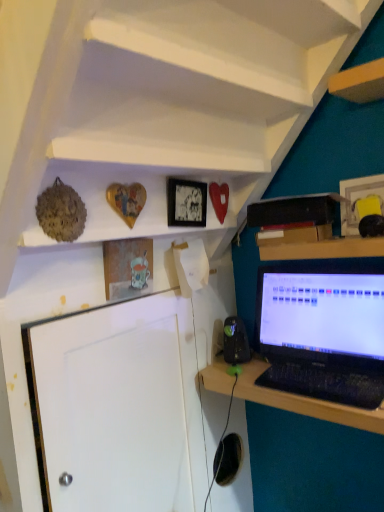
Question: From a real-world perspective, is wooden heart at upper center, arranged as the 2th shelf when viewed from the top, physically below matte black picture frame at upper center, the 2th picture frame viewed from the right?

Choices:
 (A) no
 (B) yes

Answer: (A)

Question: Is wooden heart at upper center, arranged as the 2th shelf when viewed from the top, smaller than matte black picture frame at upper center, which ranks as the 2th picture frame in left-to-right order?

Choices:
 (A) no
 (B) yes

Answer: (A)

Question: Is wooden heart at upper center, which is the first shelf in bottom-to-top order, thinner than matte black picture frame at upper center, the 2th picture frame viewed from the right?

Choices:
 (A) yes
 (B) no

Answer: (B)

Question: Would you say wooden heart at upper center, arranged as the 2th shelf when viewed from the top, is a long distance from matte black picture frame at upper center, which ranks as the 2th picture frame in left-to-right order?

Choices:
 (A) no
 (B) yes

Answer: (A)

Question: Could you tell me if wooden heart at upper center, arranged as the 2th shelf when viewed from the top, is facing matte black picture frame at upper center, which ranks as the 2th picture frame in left-to-right order?

Choices:
 (A) yes
 (B) no

Answer: (A)

Question: From the image's perspective, does wooden heart at upper center, arranged as the 2th shelf when viewed from the top, appear lower than matte black picture frame at upper center, which ranks as the 2th picture frame in left-to-right order?

Choices:
 (A) no
 (B) yes

Answer: (A)

Question: Is wooden heart at upper center, which is the first shelf in bottom-to-top order, looking in the opposite direction of white matte shelf at upper center, arranged as the first shelf when viewed from the top?

Choices:
 (A) yes
 (B) no

Answer: (B)

Question: Is wooden heart at upper center, arranged as the 2th shelf when viewed from the top, far away from white matte shelf at upper center, the second shelf when ordered from bottom to top?

Choices:
 (A) no
 (B) yes

Answer: (A)

Question: From a real-world perspective, is wooden heart at upper center, arranged as the 2th shelf when viewed from the top, located higher than white matte shelf at upper center, arranged as the first shelf when viewed from the top?

Choices:
 (A) no
 (B) yes

Answer: (A)

Question: Considering the relative sizes of wooden heart at upper center, arranged as the 2th shelf when viewed from the top, and white matte shelf at upper center, the second shelf when ordered from bottom to top, in the image provided, is wooden heart at upper center, arranged as the 2th shelf when viewed from the top, smaller than white matte shelf at upper center, the second shelf when ordered from bottom to top,?

Choices:
 (A) no
 (B) yes

Answer: (B)

Question: Can you confirm if wooden heart at upper center, which is the first shelf in bottom-to-top order, is bigger than white matte shelf at upper center, the second shelf when ordered from bottom to top?

Choices:
 (A) yes
 (B) no

Answer: (B)

Question: Considering the relative positions of wooden heart at upper center, arranged as the 2th shelf when viewed from the top, and white matte shelf at upper center, the second shelf when ordered from bottom to top, in the image provided, is wooden heart at upper center, arranged as the 2th shelf when viewed from the top, to the right of white matte shelf at upper center, the second shelf when ordered from bottom to top, from the viewer's perspective?

Choices:
 (A) no
 (B) yes

Answer: (A)

Question: From a real-world perspective, is matte glass picture frame at upper center, which is counted as the 3th picture frame, starting from the right, physically above black plastic speaker at lower center?

Choices:
 (A) no
 (B) yes

Answer: (B)